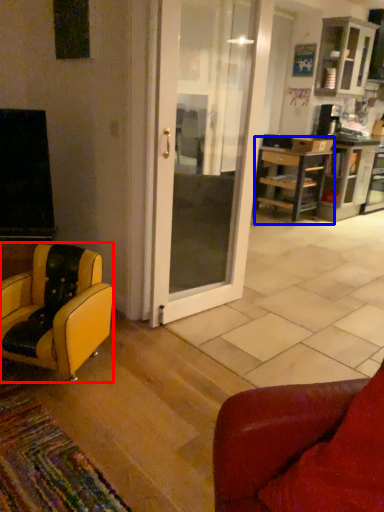
Question: Which object appears closest to the camera in this image, chair (highlighted by a red box) or desk (highlighted by a blue box)?

Choices:
 (A) chair
 (B) desk

Answer: (A)